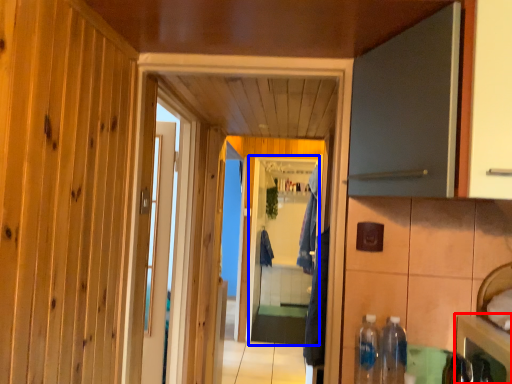
Question: Which object appears closest to the camera in this image, cabinetry (highlighted by a red box) or screen door (highlighted by a blue box)?

Choices:
 (A) cabinetry
 (B) screen door

Answer: (A)